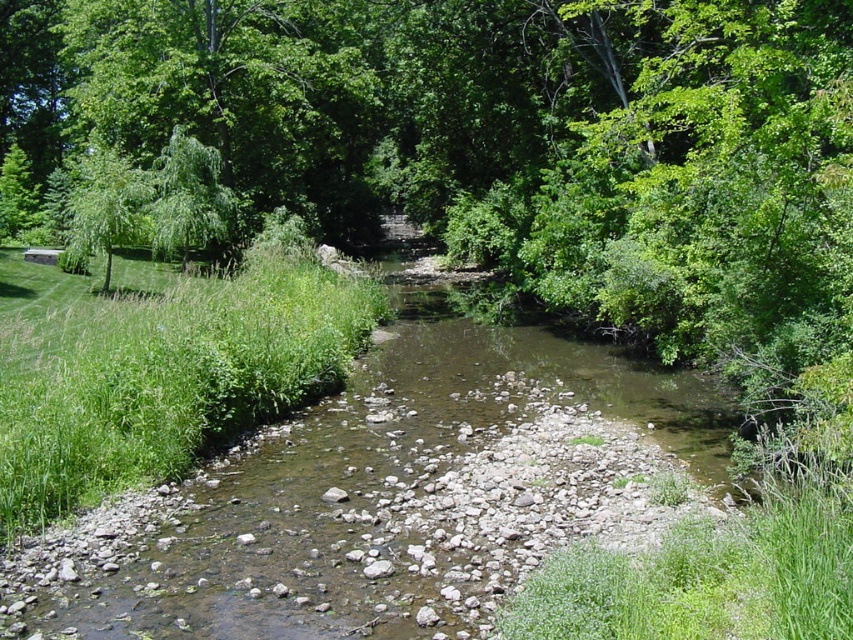
Between point (96, 451) and point (225, 224), which one is positioned in front?

Positioned in front is point (96, 451).

Is point (86, 460) farther from camera compared to point (213, 228)?

No, (86, 460) is in front of (213, 228).

Find the location of `green grass at left`. green grass at left is located at coordinates (170, 381).

Is green grass at left to the right of green leafy tree at left from the viewer's perspective?

Indeed, green grass at left is positioned on the right side of green leafy tree at left.

Is the position of green grass at left less distant than that of green leafy tree at left?

Yes, it is.

Who is more distant from viewer, [161,388] or [102,177]?

The point [102,177] is more distant.

I want to click on green grass at left, so click(170, 381).

Who is shorter, green leafy tree at upper left or green leafy tree at left?

With less height is green leafy tree at upper left.

Is green leafy tree at upper left below green leafy tree at left?

Correct, green leafy tree at upper left is located below green leafy tree at left.

Where is `green leafy tree at upper left`? Image resolution: width=853 pixels, height=640 pixels. green leafy tree at upper left is located at coordinates (190, 200).